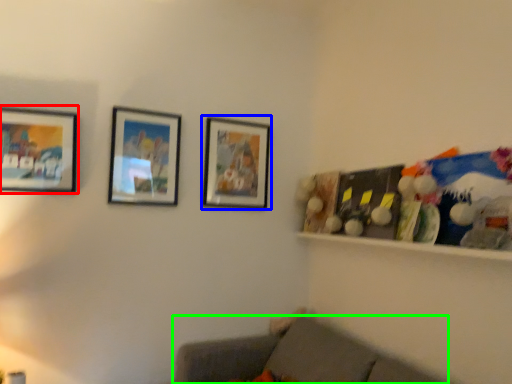
Question: Based on their relative distances, which object is nearer to picture frame (highlighted by a red box)? Choose from picture frame (highlighted by a blue box) and studio couch (highlighted by a green box).

Choices:
 (A) picture frame
 (B) studio couch

Answer: (A)